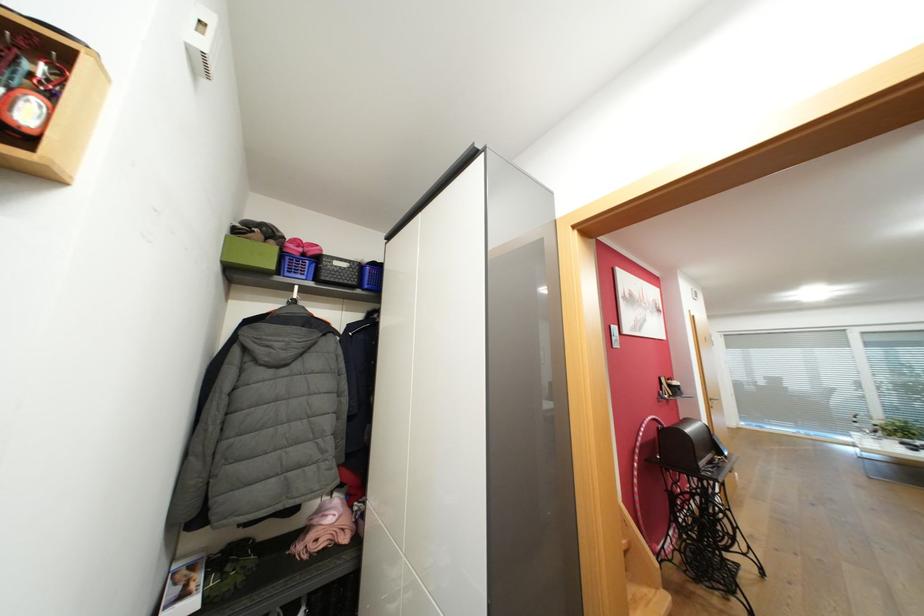
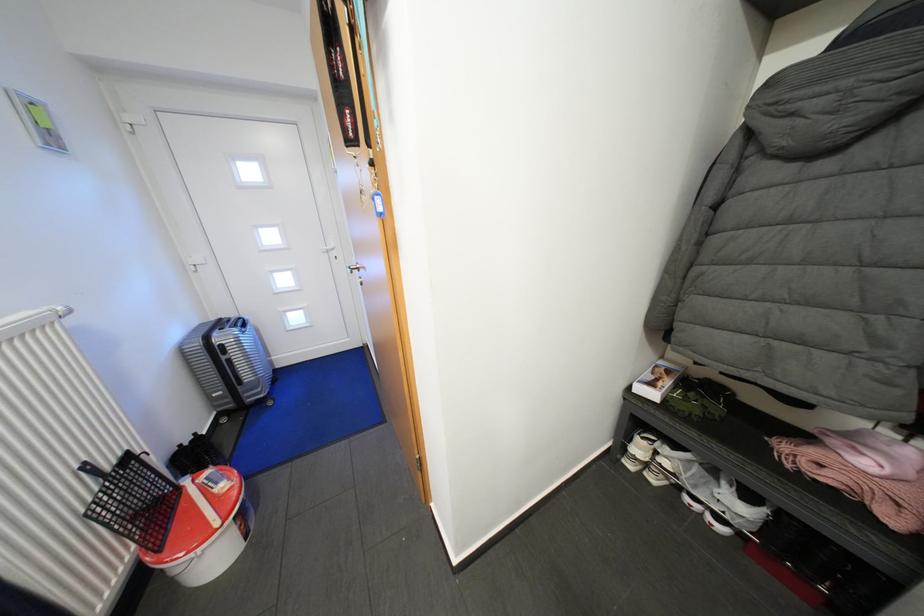
The images are taken continuously from a first-person perspective. In which direction is your viewpoint rotating?

The rotation direction of the camera is left-down.